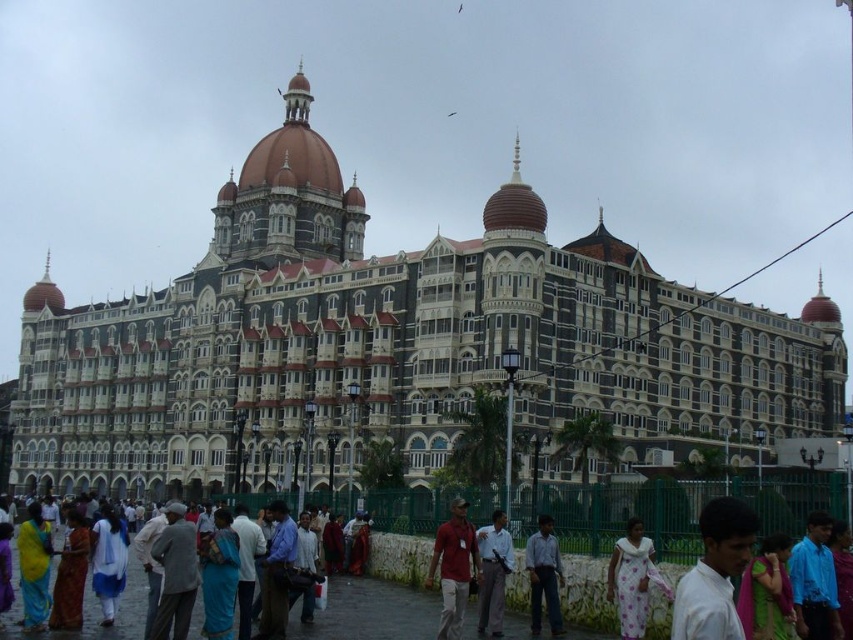
You are standing in front of the grand building and notice two people wearing shirts of different colors. The blue shirt at center and the matte red shirt at center. Which one is positioned more to the right?

The blue shirt at center is positioned more to the right than the matte red shirt at center.

You are a photographer trying to capture a detailed shot of the crowd in front of the grand building. You notice the gray fabric jacket at center and the matte yellow sari at lower left. Which clothing item appears narrower in your photo?

The gray fabric jacket at center appears narrower because it is thinner than the matte yellow sari at lower left.